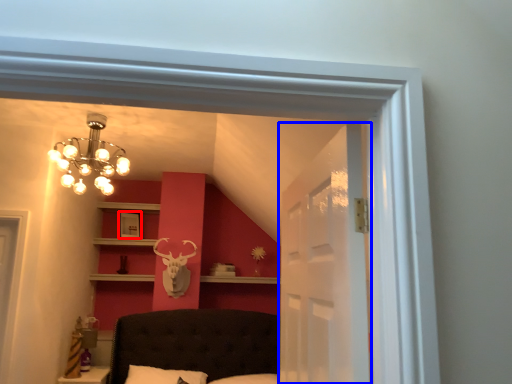
Question: Among these objects, which one is farthest to the camera, picture frame (highlighted by a red box) or glass door (highlighted by a blue box)?

Choices:
 (A) picture frame
 (B) glass door

Answer: (A)